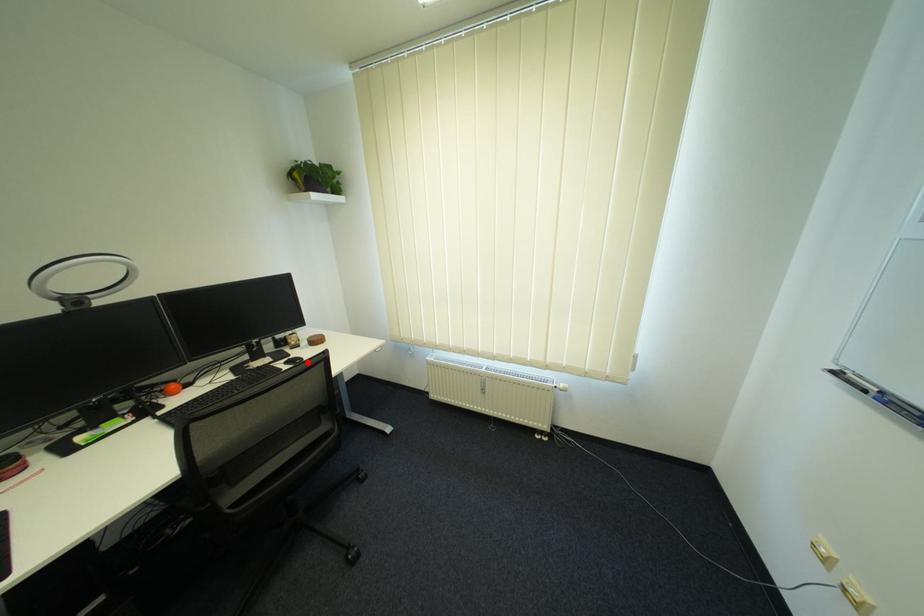
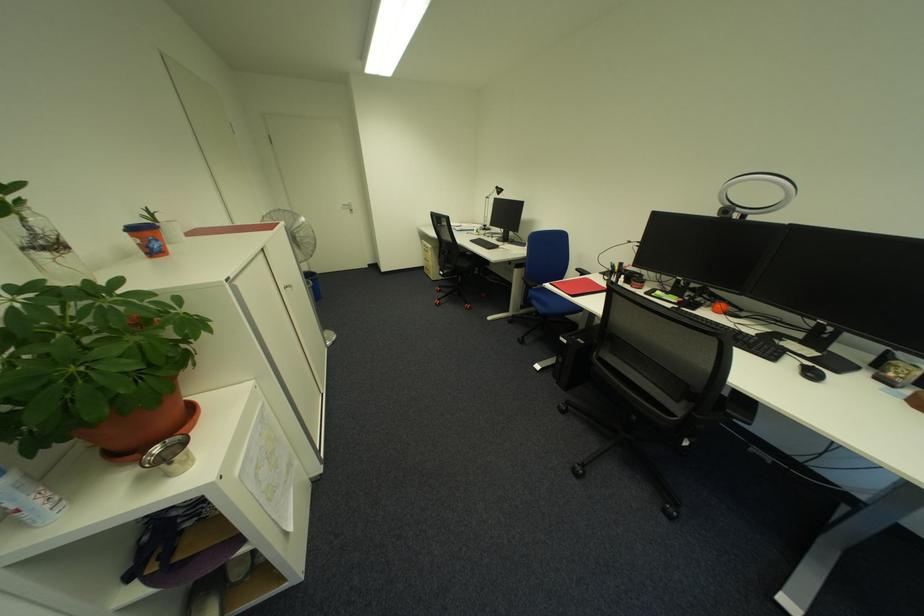
Find the pixel in the second image that matches the highlighted location in the first image.

(820, 376)